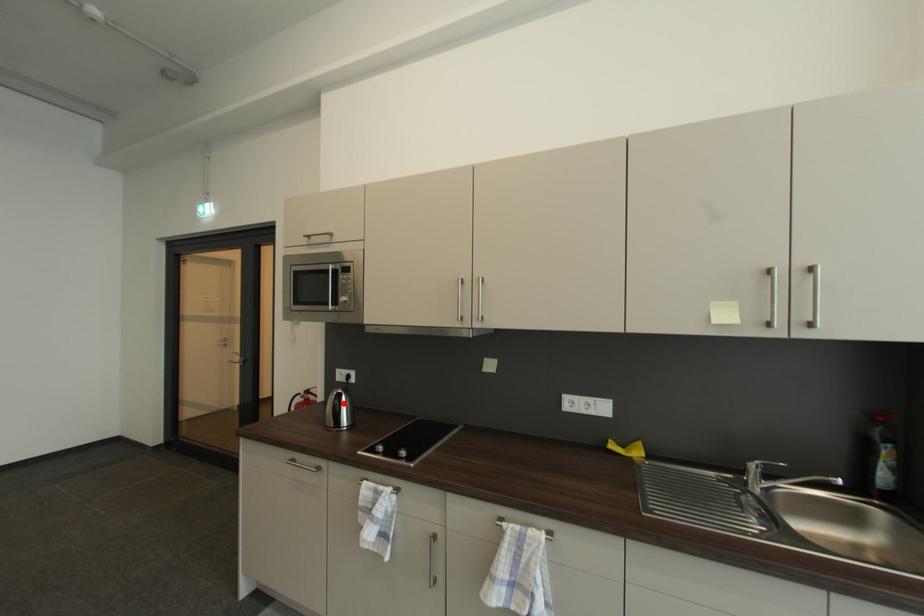
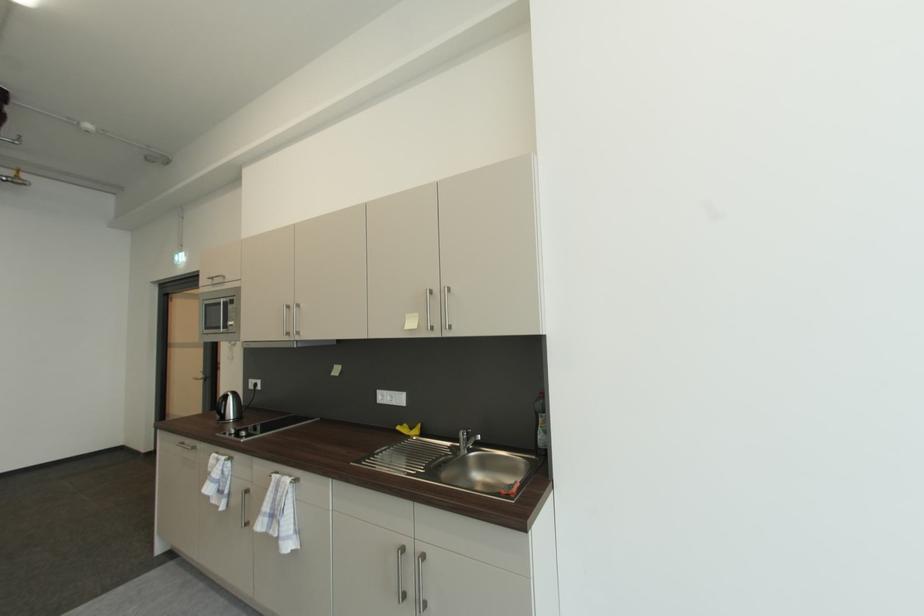
Find the pixel in the second image that matches the highlighted location in the first image.

(227, 402)